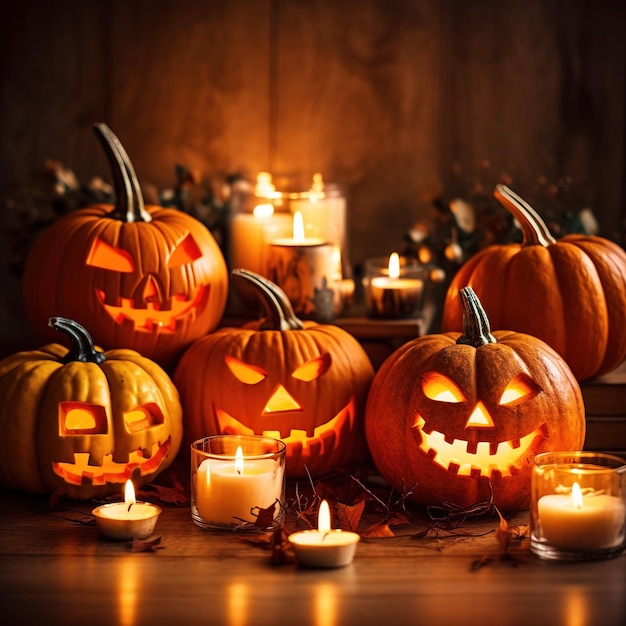
At what (x,y) coordinates should I click in order to perform the action: click on candles. Please return your answer as a coordinate pair (x, y). The width and height of the screenshot is (626, 626). Looking at the image, I should click on (555, 508), (336, 541), (221, 471), (128, 526), (297, 255), (250, 233).